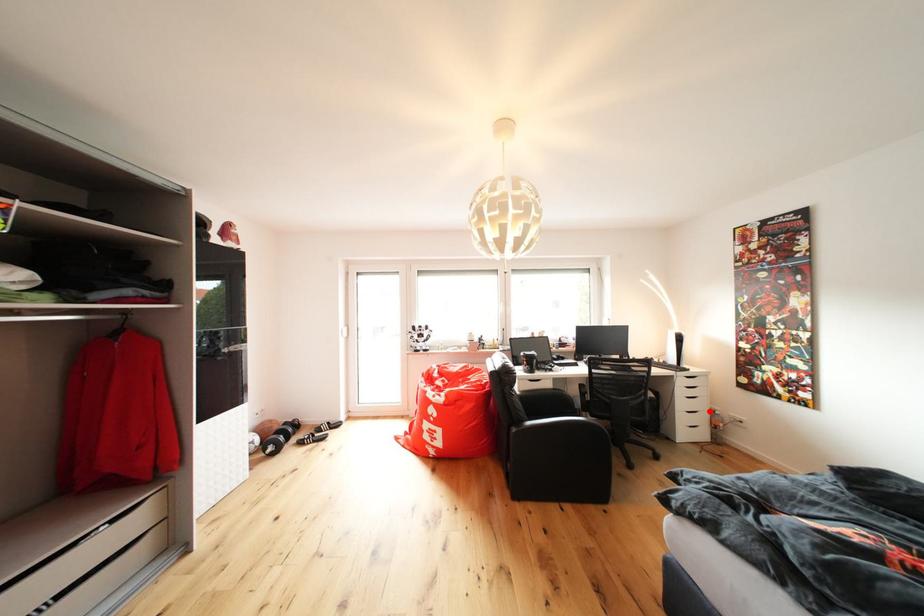
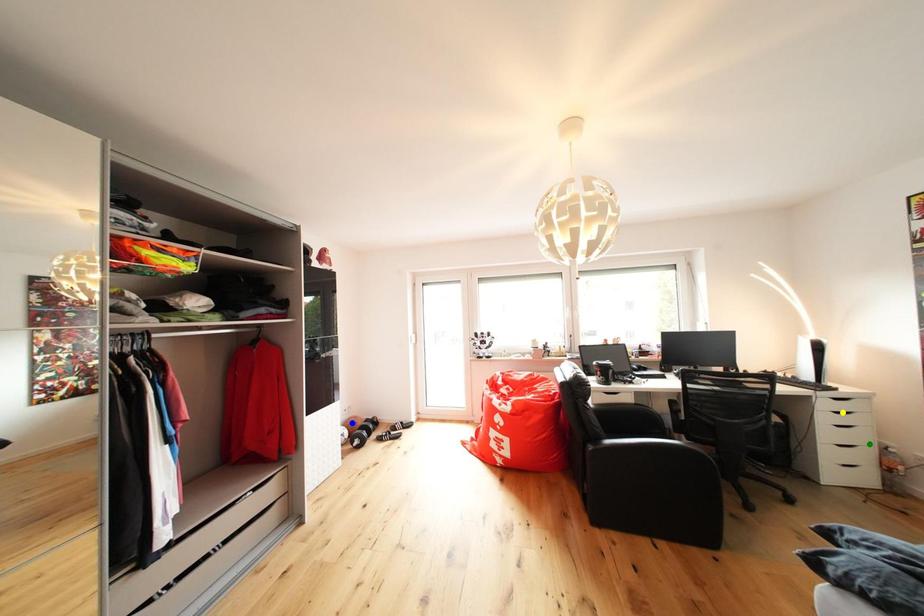
Question: I am providing you with two images of the same scene from different viewpoints. A red point is marked on the first image. You are given multiple points on the second image. Which point in image 2 is actually the same real-world point as the red point in image 1?

Choices:
 (A) blue point
 (B) yellow point
 (C) green point

Answer: (C)